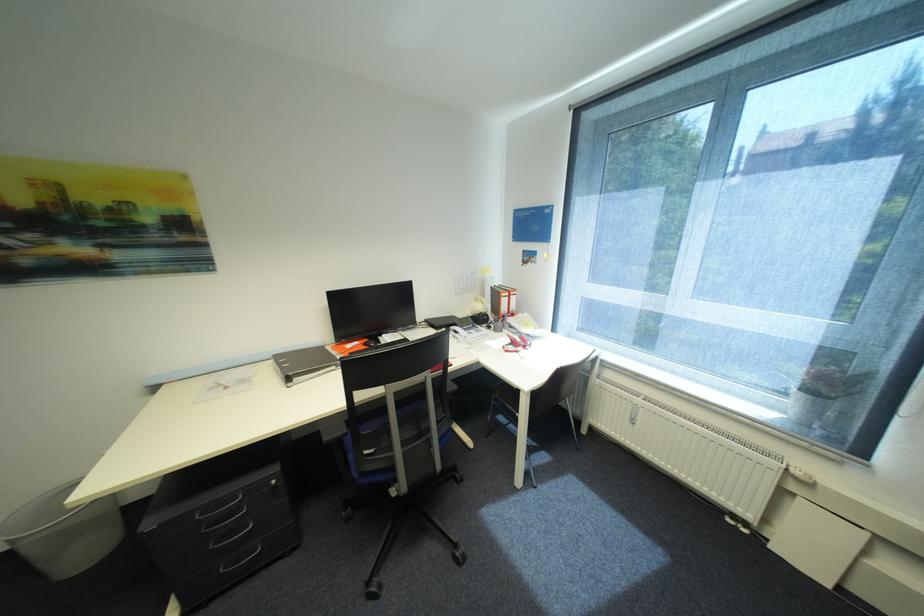
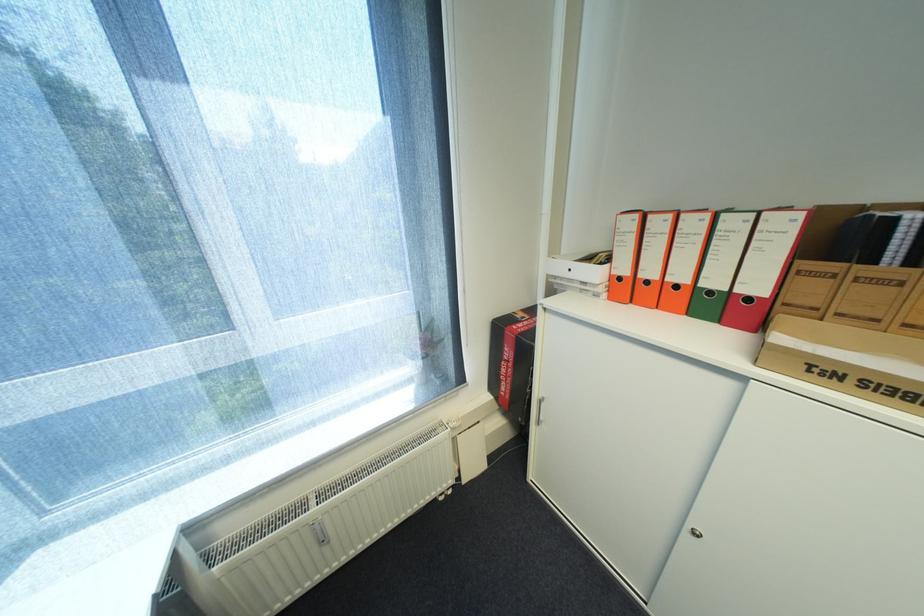
Locate, in the second image, the point that corresponds to point (638, 416) in the first image.

(326, 541)